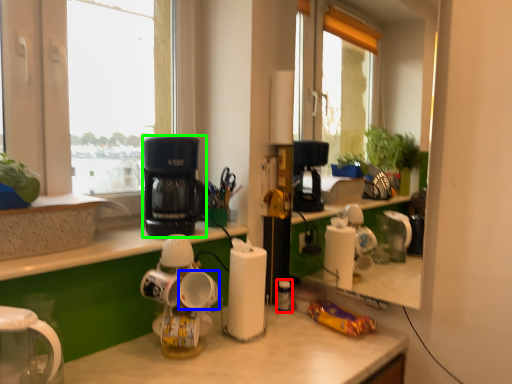
Question: Which is farther away from bottle (highlighted by a red box)? mug (highlighted by a blue box) or kitchen appliance (highlighted by a green box)?

Choices:
 (A) mug
 (B) kitchen appliance

Answer: (B)